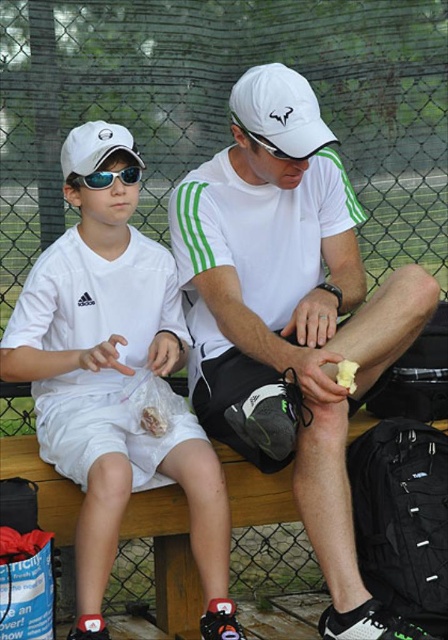
Question: Can you confirm if matte black goggles at left is smaller than yellow butter at lower right?

Choices:
 (A) yes
 (B) no

Answer: (B)

Question: Estimate the real-world distances between objects in this image. Which object is closer to the white matte baseball cap at upper left?

Choices:
 (A) white matte tennis outfit at center
 (B) white matte tennis shoe at lower center
 (C) yellow butter at lower right

Answer: (A)

Question: Based on their relative distances, which object is nearer to the white matte tennis outfit at center?

Choices:
 (A) matte black goggles at left
 (B) yellow butter at lower right

Answer: (A)

Question: Is white matte tennis shoe at lower center further to the viewer compared to yellow butter at lower right?

Choices:
 (A) no
 (B) yes

Answer: (A)

Question: Is white matte tennis outfit at center bigger than white matte baseball cap at upper left?

Choices:
 (A) no
 (B) yes

Answer: (B)

Question: Which point appears closest to the camera in this image?

Choices:
 (A) (100, 452)
 (B) (100, 172)

Answer: (A)